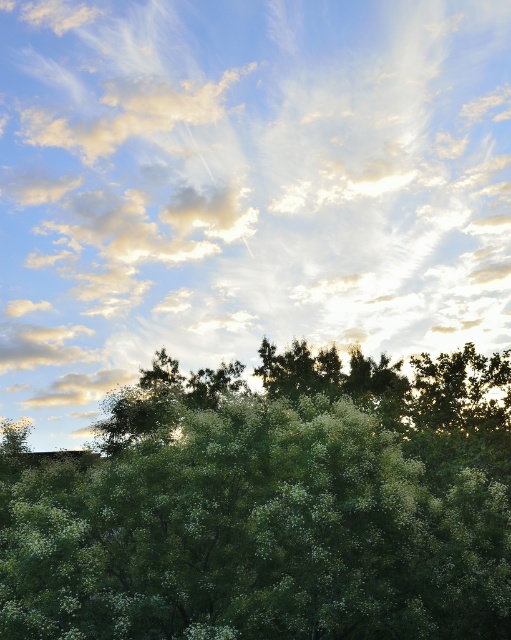
You are an observer looking at the sky scene. You notice the white fluffy cloud at upper center and the green leafy tree at center. Which object is positioned to the left of the other?

The white fluffy cloud at upper center is positioned to the left of the green leafy tree at center.

You are an ornithologist observing this sky scene. You notice a white fluffy cloud at upper center and a green leafy tree at center. Which object is located higher in the sky?

The white fluffy cloud at upper center is positioned over the green leafy tree at center, so it is higher in the sky.